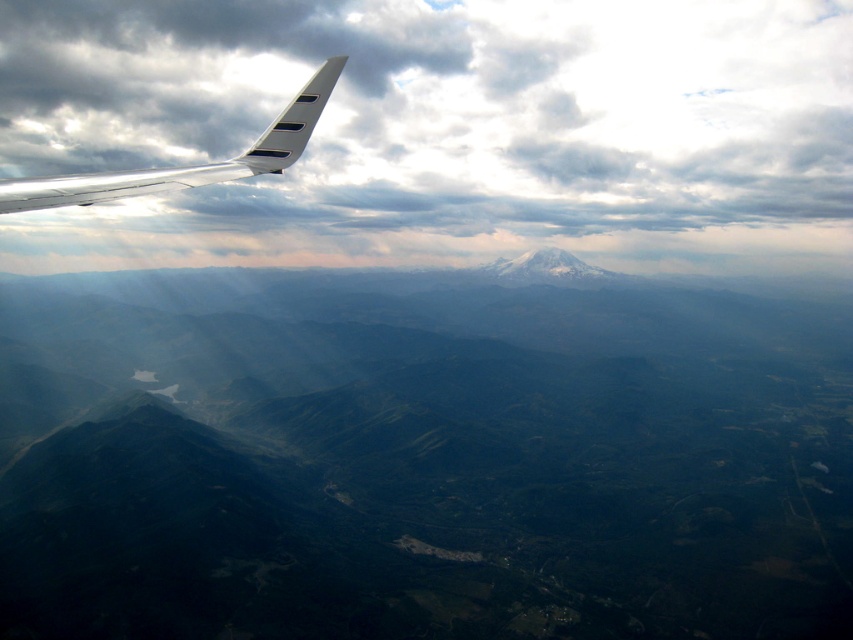
Question: Does green textured mountains at center appear on the right side of cloudy sky at upper center?

Choices:
 (A) no
 (B) yes

Answer: (A)

Question: Which object is positioned closest to the silver metallic wing at upper left?

Choices:
 (A) cloudy sky at upper center
 (B) green textured mountains at center
 (C) transparent plastic airplane window at upper left

Answer: (C)

Question: Which point appears farthest from the camera in this image?

Choices:
 (A) (334, 74)
 (B) (299, 96)
 (C) (227, 93)
 (D) (106, 552)

Answer: (C)

Question: Which object is positioned closest to the cloudy sky at upper center?

Choices:
 (A) transparent plastic airplane window at upper left
 (B) green textured mountains at center
 (C) silver metallic wing at upper left

Answer: (B)

Question: Is cloudy sky at upper center closer to camera compared to transparent plastic airplane window at upper left?

Choices:
 (A) yes
 (B) no

Answer: (B)

Question: Can you confirm if green textured mountains at center is positioned to the right of transparent plastic airplane window at upper left?

Choices:
 (A) no
 (B) yes

Answer: (A)